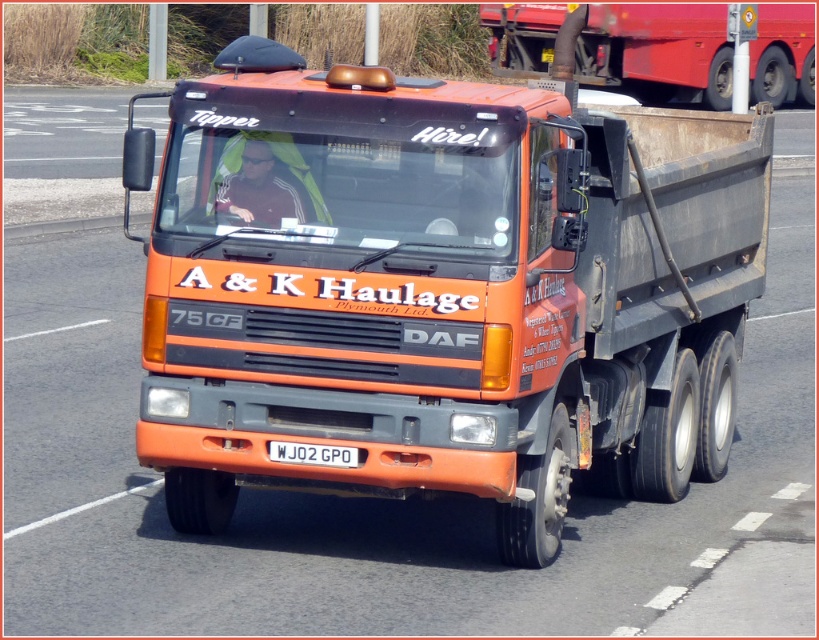
Question: Which of the following is the closest to the observer?

Choices:
 (A) orange matte trailer truck at center
 (B) white plastic license plate at center

Answer: (B)

Question: Does orange matte trailer truck at center appear on the left side of white plastic license plate at center?

Choices:
 (A) no
 (B) yes

Answer: (A)

Question: Is orange matte trailer truck at center wider than white plastic license plate at center?

Choices:
 (A) yes
 (B) no

Answer: (B)

Question: Can you confirm if orange matte trailer truck at center is positioned to the left of white plastic license plate at center?

Choices:
 (A) yes
 (B) no

Answer: (B)